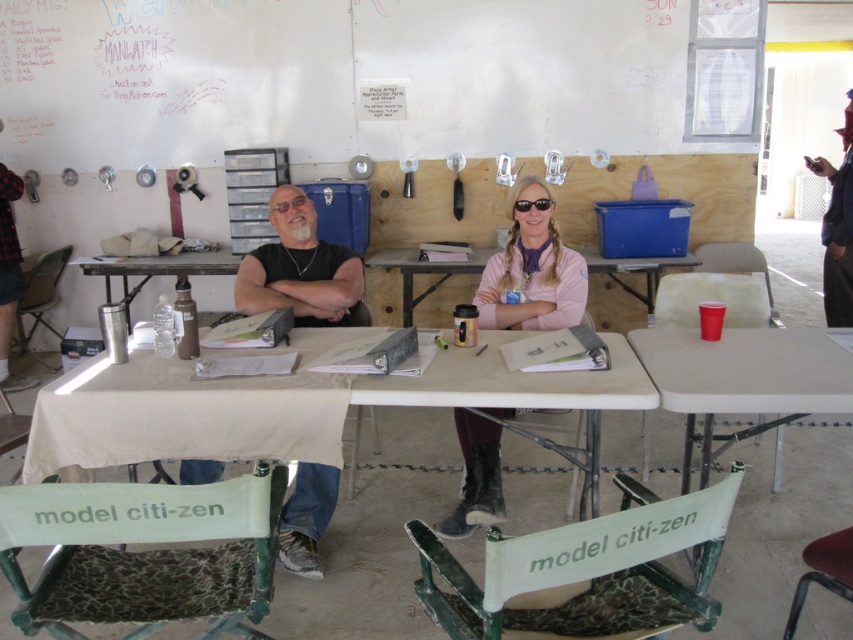
Question: Based on their relative distances, which object is nearer to the black matte shirt at center?

Choices:
 (A) white plastic table at center
 (B) pink fabric table at center

Answer: (A)

Question: Is pink fleece jacket at center smaller than pink fabric table at center?

Choices:
 (A) yes
 (B) no

Answer: (A)

Question: Which point is closer to the camera?

Choices:
 (A) red plastic cup at right
 (B) black matte shirt at center
 (C) white matte bulletin board at upper center
 (D) sunglasses at center

Answer: (A)

Question: Can you confirm if white matte bulletin board at upper center is positioned to the left of black matte shirt at center?

Choices:
 (A) yes
 (B) no

Answer: (B)

Question: Which point is farther from the camera taking this photo?

Choices:
 (A) (352, 285)
 (B) (596, 252)
 (C) (161, 448)

Answer: (B)

Question: Can you confirm if white plastic table at center is positioned to the right of pink fabric table at center?

Choices:
 (A) no
 (B) yes

Answer: (A)